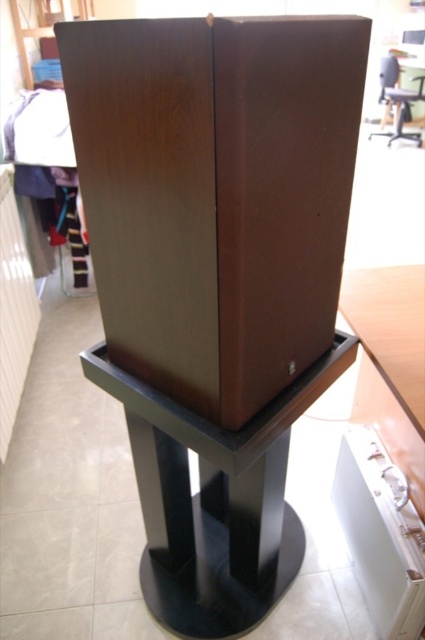
Who is taller, wooden speaker at center or black matte table at center?

Standing taller between the two is black matte table at center.

Which is below, wooden speaker at center or black matte table at center?

Positioned lower is black matte table at center.

You are a GUI agent. You are given a task and a screenshot of the screen. Output one action in this format:
    pyautogui.click(x=<x>, y=<y>)
    Task: Click on the wooden speaker at center
    Image resolution: width=425 pixels, height=640 pixels.
    Given the screenshot: What is the action you would take?
    pyautogui.click(x=217, y=195)